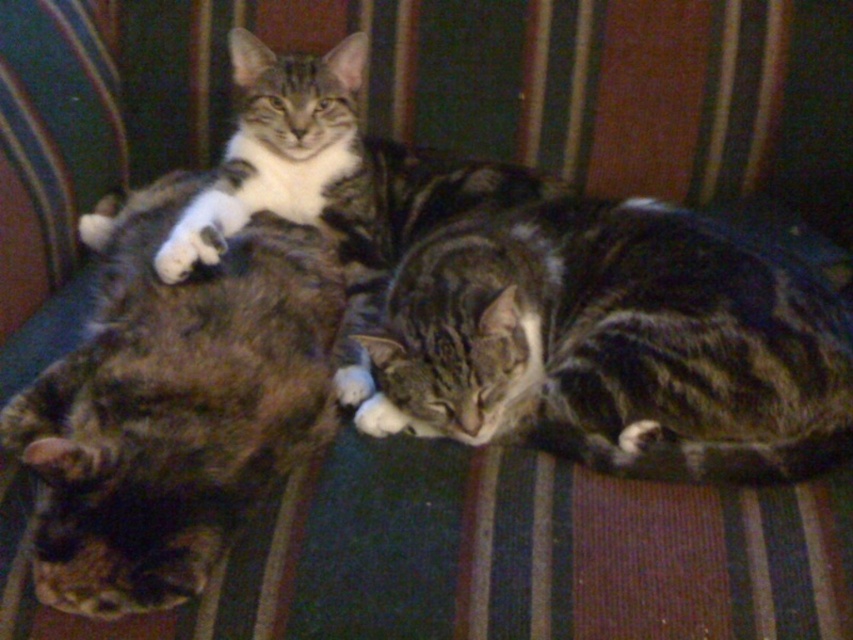
You are a photographer trying to capture a photo of both cats. You notice that the tabby fur cat at center and the tabby fur cat at left are positioned in a way that might block each other. Based on their positions, which cat is higher up in the image?

The tabby fur cat at center is above the tabby fur cat at left, so it is higher up in the image.

You are a cat owner who wants to place a small toy exactly at the center of the image. The tabby fur cat at center is currently located at coordinates 0.539 on the x axis and 0.723 on the y axis. Will the toy be placed directly in front of the cat if you aim for the image center?

The tabby fur cat at center is at point (616, 344), which is slightly to the right and below the true center of the image. Therefore, placing the toy at the image center would not be directly in front of the cat.